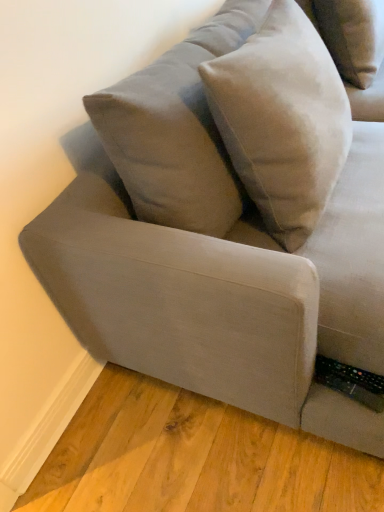
Question: From a real-world perspective, is suede beige pillow at upper center below suede-like beige pillow at upper right?

Choices:
 (A) yes
 (B) no

Answer: (B)

Question: Is suede beige pillow at upper center further to the viewer compared to suede-like beige pillow at upper right?

Choices:
 (A) no
 (B) yes

Answer: (A)

Question: From a real-world perspective, is suede beige pillow at upper center physically above suede-like beige pillow at upper right?

Choices:
 (A) yes
 (B) no

Answer: (A)

Question: Does suede beige pillow at upper center have a greater width compared to suede-like beige pillow at upper right?

Choices:
 (A) no
 (B) yes

Answer: (A)

Question: Does suede beige pillow at upper center have a smaller size compared to suede-like beige pillow at upper right?

Choices:
 (A) no
 (B) yes

Answer: (A)

Question: From the image's perspective, is suede beige pillow at upper center on top of suede-like beige pillow at upper right?

Choices:
 (A) no
 (B) yes

Answer: (A)

Question: From a real-world perspective, is suede-like beige pillow at upper right located beneath suede beige pillow at upper center?

Choices:
 (A) yes
 (B) no

Answer: (A)

Question: Is suede-like beige pillow at upper right further to camera compared to suede beige pillow at upper center?

Choices:
 (A) no
 (B) yes

Answer: (B)

Question: Is suede-like beige pillow at upper right closer to camera compared to suede beige pillow at upper center?

Choices:
 (A) yes
 (B) no

Answer: (B)

Question: Considering the relative sizes of suede-like beige pillow at upper right and suede beige pillow at upper center in the image provided, is suede-like beige pillow at upper right wider than suede beige pillow at upper center?

Choices:
 (A) yes
 (B) no

Answer: (A)

Question: Considering the relative positions of suede-like beige pillow at upper right and suede beige pillow at upper center in the image provided, is suede-like beige pillow at upper right to the right of suede beige pillow at upper center from the viewer's perspective?

Choices:
 (A) yes
 (B) no

Answer: (A)

Question: Is suede-like beige pillow at upper right bigger than suede beige pillow at upper center?

Choices:
 (A) no
 (B) yes

Answer: (A)

Question: From the image's perspective, is suede-like beige pillow at upper right positioned above or below suede beige pillow at upper center?

Choices:
 (A) above
 (B) below

Answer: (A)